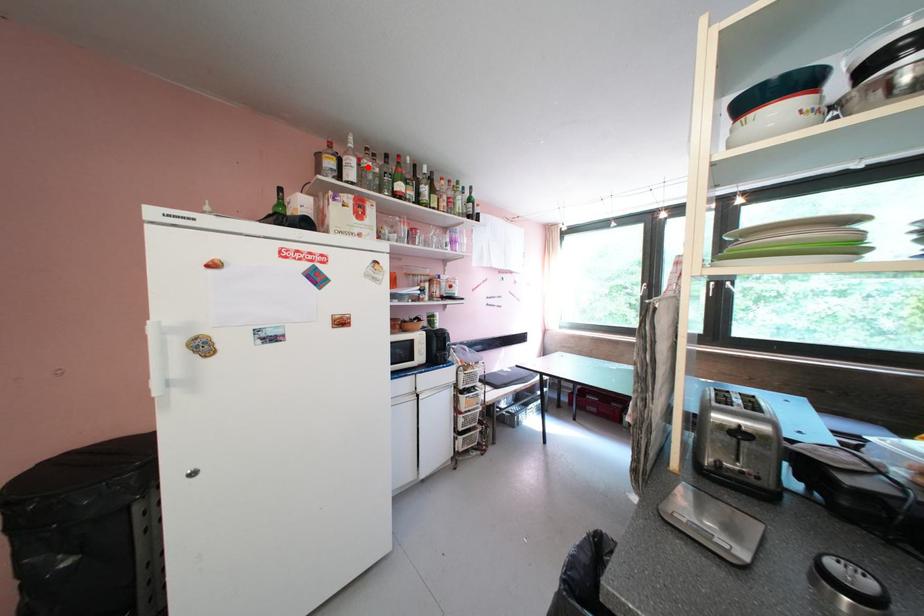
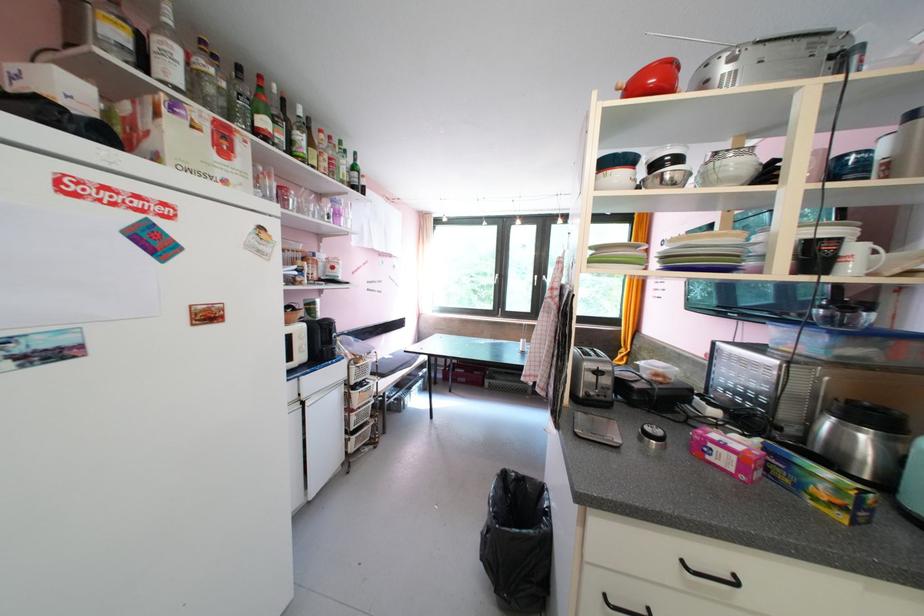
Locate, in the second image, the point that corresponds to the highlighted location in the first image.

(196, 65)